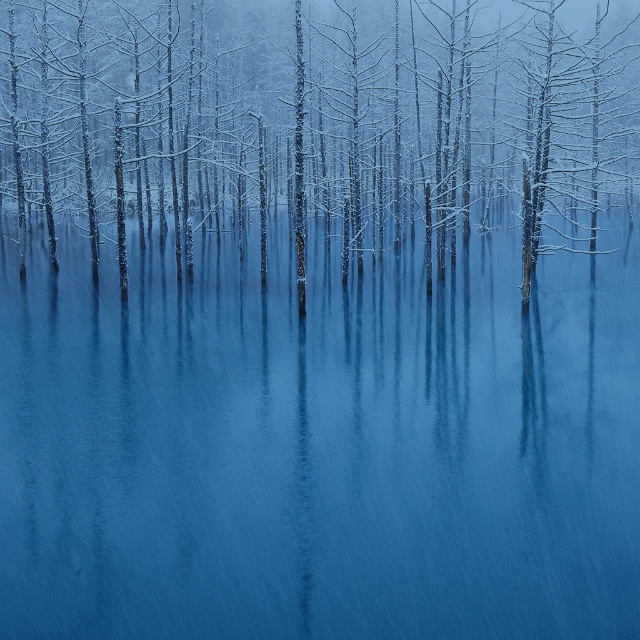
Can you confirm if blue glossy water at center is positioned above snow-covered tree at center?

Incorrect, blue glossy water at center is not positioned above snow-covered tree at center.

Does point (563, 621) come farther from viewer compared to point (634, 164)?

That is False.

You are a GUI agent. You are given a task and a screenshot of the screen. Output one action in this format:
    pyautogui.click(x=<x>, y=<y>)
    Task: Click on the blue glossy water at center
    This screenshot has width=640, height=640.
    Given the screenshot: What is the action you would take?
    pyautogui.click(x=320, y=444)